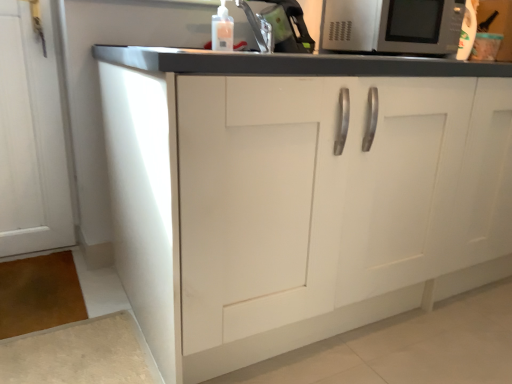
Question: From the image's perspective, is white matte cabinet at center beneath translucent plastic bottle at upper center?

Choices:
 (A) yes
 (B) no

Answer: (A)

Question: Is white matte cabinet at center positioned before translucent plastic bottle at upper center?

Choices:
 (A) no
 (B) yes

Answer: (B)

Question: Can you confirm if white matte cabinet at center is shorter than translucent plastic bottle at upper center?

Choices:
 (A) no
 (B) yes

Answer: (A)

Question: Can you confirm if white matte cabinet at center is bigger than translucent plastic bottle at upper center?

Choices:
 (A) yes
 (B) no

Answer: (A)

Question: From the image's perspective, is white matte cabinet at center located above translucent plastic bottle at upper center?

Choices:
 (A) yes
 (B) no

Answer: (B)

Question: Visually, is translucent plastic bottle at upper center positioned to the left or to the right of transparent plastic sink at upper center?

Choices:
 (A) right
 (B) left

Answer: (B)

Question: In terms of width, does translucent plastic bottle at upper center look wider or thinner when compared to transparent plastic sink at upper center?

Choices:
 (A) wide
 (B) thin

Answer: (B)

Question: From their relative heights in the image, would you say translucent plastic bottle at upper center is taller or shorter than transparent plastic sink at upper center?

Choices:
 (A) tall
 (B) short

Answer: (B)

Question: Is point (224, 29) closer or farther from the camera than point (267, 11)?

Choices:
 (A) farther
 (B) closer

Answer: (B)

Question: In terms of height, does transparent plastic sink at upper center look taller or shorter compared to translucent plastic bottle at upper center?

Choices:
 (A) short
 (B) tall

Answer: (B)

Question: From the image's perspective, is transparent plastic sink at upper center above or below translucent plastic bottle at upper center?

Choices:
 (A) below
 (B) above

Answer: (B)

Question: From a real-world perspective, is transparent plastic sink at upper center above or below translucent plastic bottle at upper center?

Choices:
 (A) above
 (B) below

Answer: (A)

Question: Is point (205, 0) closer or farther from the camera than point (221, 44)?

Choices:
 (A) farther
 (B) closer

Answer: (A)

Question: From a real-world perspective, relative to translucent plastic bottle at upper center, is white matte cabinet at center vertically above or below?

Choices:
 (A) above
 (B) below

Answer: (B)

Question: Looking at their shapes, would you say white matte cabinet at center is wider or thinner than translucent plastic bottle at upper center?

Choices:
 (A) wide
 (B) thin

Answer: (A)